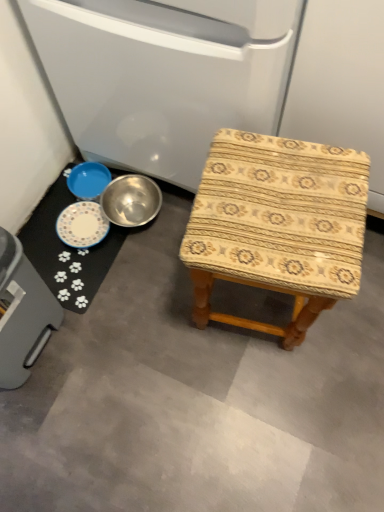
Question: Which is correct: blue metallic bowl at lower left is inside gray plastic trash can at lower left, acting as the second appliance starting from the top, or outside of it?

Choices:
 (A) outside
 (B) inside

Answer: (A)

Question: From the image's perspective, is blue metallic bowl at lower left above or below gray plastic trash can at lower left, acting as the second appliance starting from the top?

Choices:
 (A) above
 (B) below

Answer: (A)

Question: Which object is the farthest from the metallic bowl at lower left, the 1th appliance when ordered from top to bottom?

Choices:
 (A) blue metallic bowl at lower left
 (B) white paw print mat at lower left
 (C) gray plastic trash can at lower left, which is counted as the first appliance, starting from the left
 (D) wooden-patterned stool at center

Answer: (C)

Question: Based on their relative distances, which object is farther from the gray plastic trash can at lower left, which is counted as the first appliance, starting from the left?

Choices:
 (A) white paw print mat at lower left
 (B) metallic bowl at lower left, the 2th appliance positioned from the left
 (C) wooden-patterned stool at center
 (D) blue metallic bowl at lower left

Answer: (B)